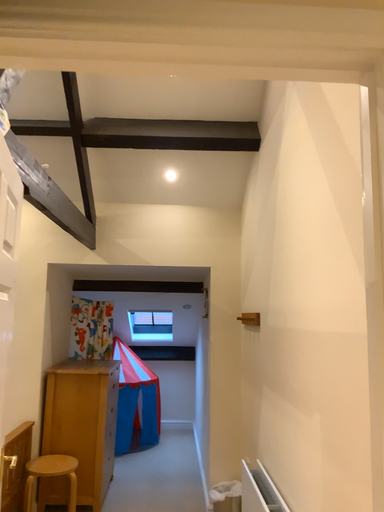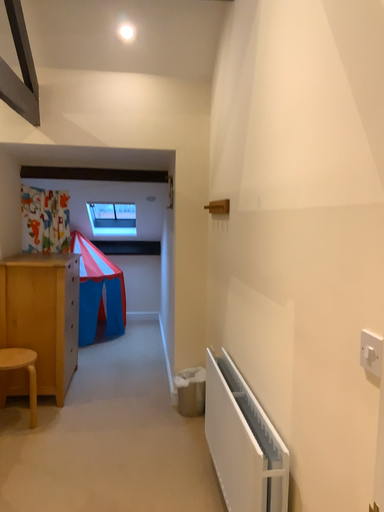
Question: How did the camera likely rotate when shooting the video?

Choices:
 (A) rotated upward
 (B) rotated downward

Answer: (B)